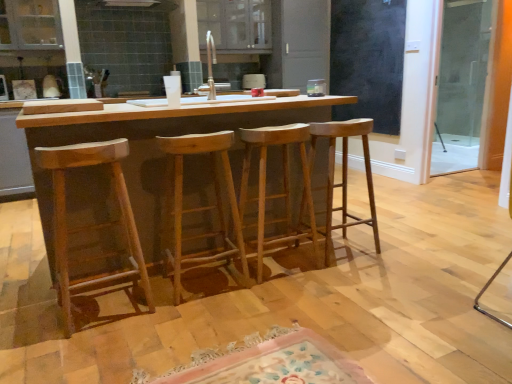
At what (x,y) coordinates should I click in order to perform the action: click on vacant space situated on the left part of natural wood stool at left, the 4th stool when ordered from right to left. Please return your answer as a coordinate pair (x, y). Looking at the image, I should click on (30, 313).